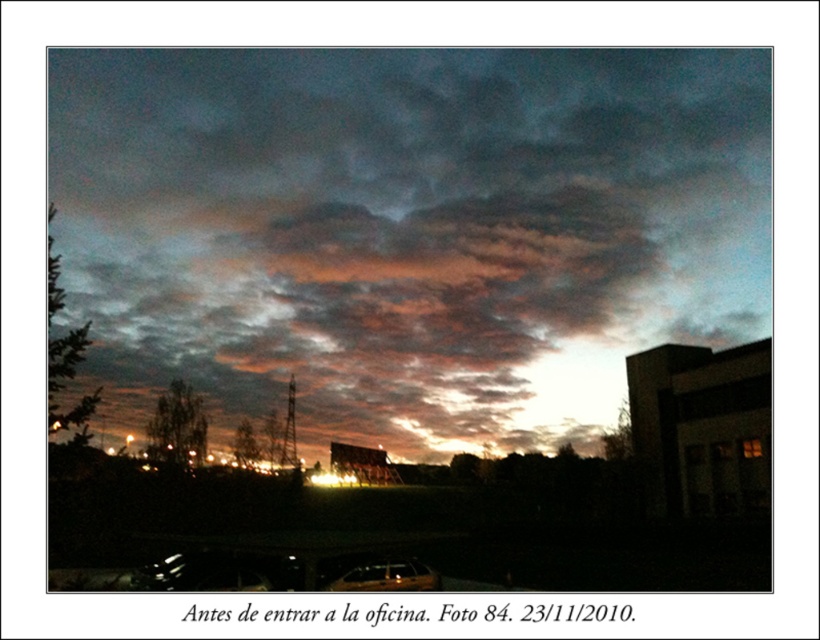
Which is above, cloudy sky at upper center or metallic silver car at lower center?

cloudy sky at upper center is higher up.

Who is more forward, (618, 76) or (190, 570)?

Positioned in front is point (190, 570).

In order to click on cloudy sky at upper center in this screenshot , I will do `click(408, 228)`.

In the scene shown: Between metallic silver car at lower center and transparent glass car window at lower center, which one appears on the left side from the viewer's perspective?

Positioned to the left is metallic silver car at lower center.

The width and height of the screenshot is (820, 640). What do you see at coordinates (199, 573) in the screenshot?
I see `metallic silver car at lower center` at bounding box center [199, 573].

Who is more distant from viewer, (208,552) or (381,572)?

Point (208,552)

Locate an element on the screen. metallic silver car at lower center is located at coordinates (199, 573).

Which is behind, point (94, 186) or point (379, 577)?

Positioned behind is point (94, 186).

Is cloudy sky at upper center to the left of metallic gold car at lower center from the viewer's perspective?

Incorrect, cloudy sky at upper center is not on the left side of metallic gold car at lower center.

Where is `cloudy sky at upper center`? The image size is (820, 640). cloudy sky at upper center is located at coordinates (408, 228).